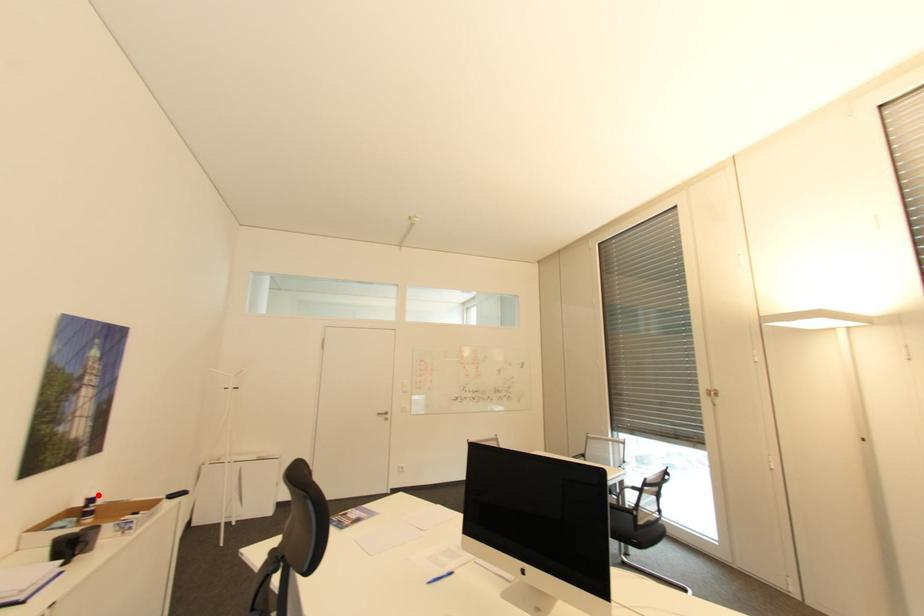
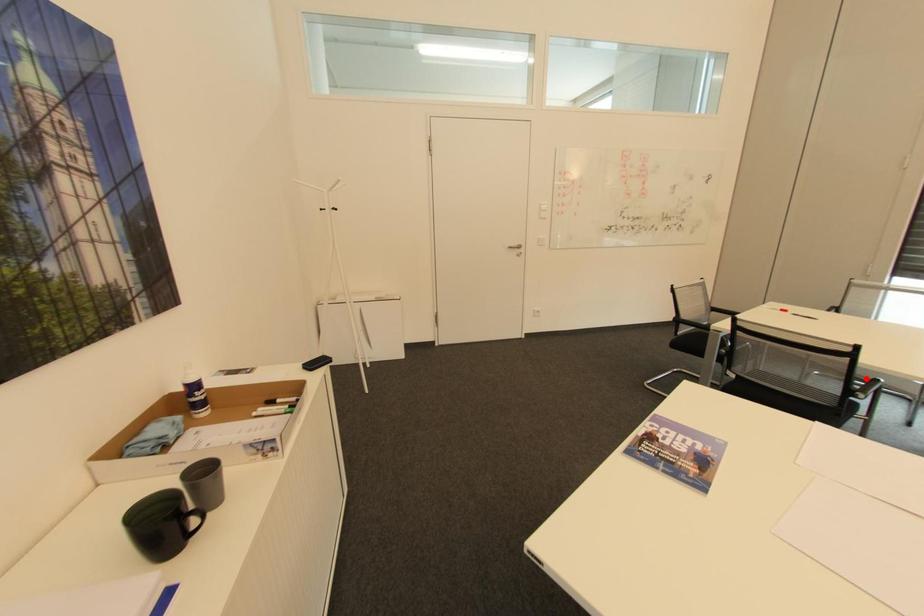
I am providing you with two images of the same scene from different viewpoints. A red point is marked on the first image and another point is marked on the second image. Are the points marked in image1 and image2 representing the same 3D position?

No